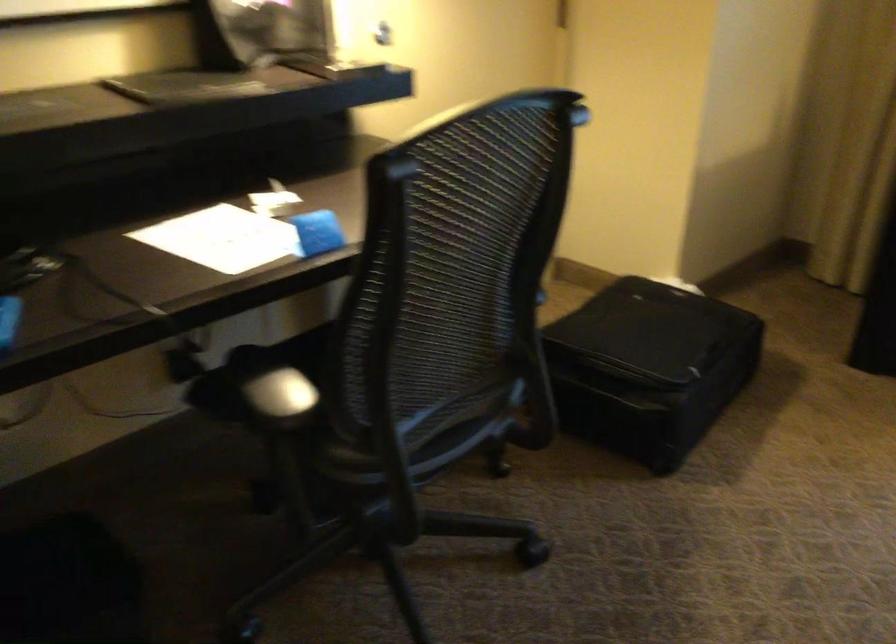
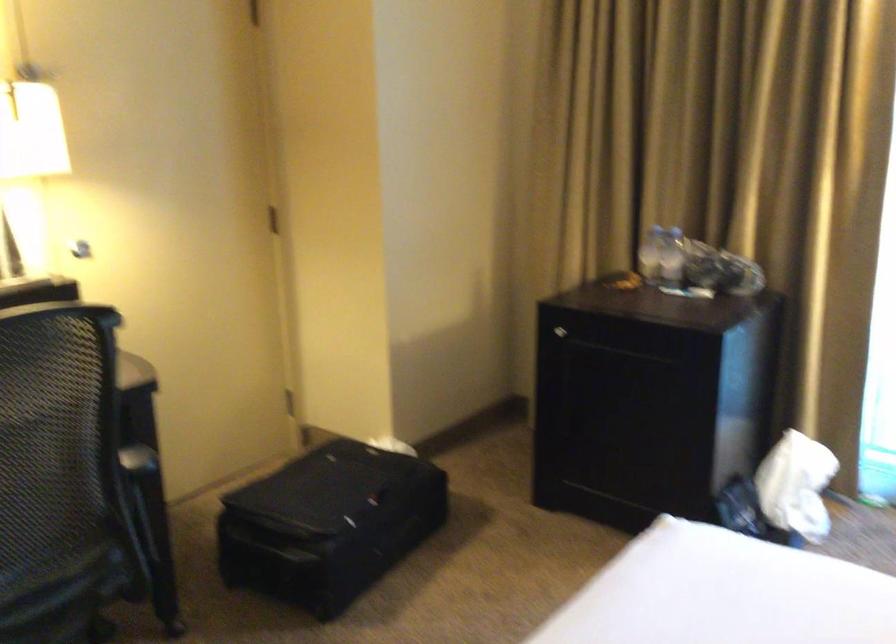
Find the pixel in the second image that matches point 494,361 in the first image.

(136, 527)